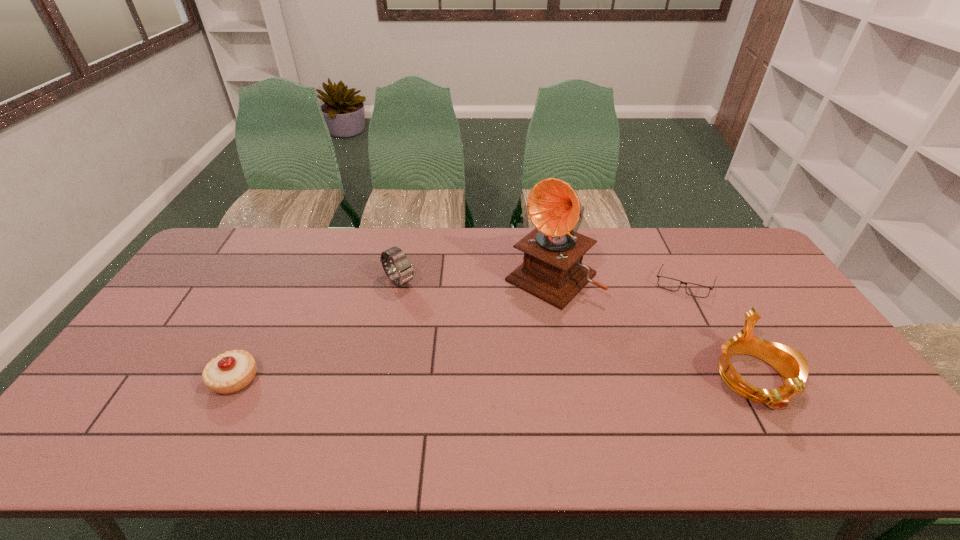
This screenshot has width=960, height=540. I want to click on the leftmost object, so click(x=230, y=372).

In order to click on the second shortest object in this screenshot , I will do `click(230, 372)`.

Where is `tiara`? The image size is (960, 540). tiara is located at coordinates (793, 367).

Where is `the tallest object`? This screenshot has height=540, width=960. the tallest object is located at coordinates (552, 270).

You are a GUI agent. You are given a task and a screenshot of the screen. Output one action in this format:
    pyautogui.click(x=<x>, y=<y>)
    Task: Click on the phonograph record
    This screenshot has height=540, width=960.
    Given the screenshot: What is the action you would take?
    pyautogui.click(x=552, y=270)

Locate an element on the screen. The image size is (960, 540). spectacles is located at coordinates (696, 290).

Find the location of a particular element. Image resolution: width=960 pixels, height=540 pixels. watch is located at coordinates (405, 273).

I want to click on vacant space located 0.160m on the right of the fourth tallest object, so click(x=321, y=379).

Where is `vacant space located on the horn of the third object from left to right`? Image resolution: width=960 pixels, height=540 pixels. vacant space located on the horn of the third object from left to right is located at coordinates (465, 359).

Where is `free space located on the horn of the third object from left to right`? free space located on the horn of the third object from left to right is located at coordinates (477, 347).